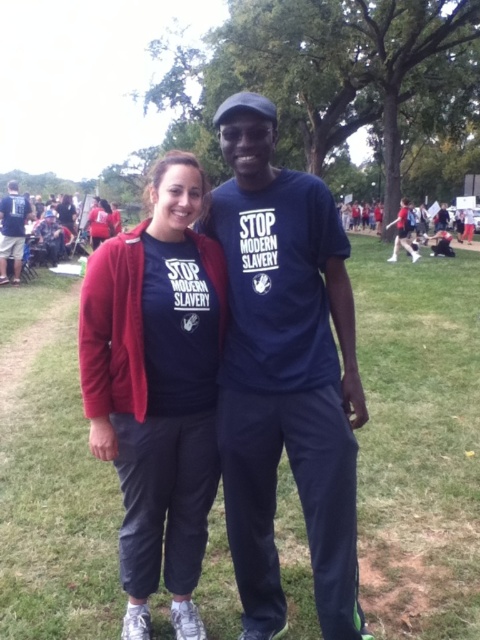
Locate an element on the screen. The width and height of the screenshot is (480, 640). navy blue t-shirt at center is located at coordinates (285, 372).

What are the coordinates of `navy blue t-shirt at center` in the screenshot? It's located at (285, 372).

Is navy blue t-shirt at center positioned in front of matte blue t-shirt at center?

Yes.

How much distance is there between navy blue t-shirt at center and matte blue t-shirt at center?

navy blue t-shirt at center and matte blue t-shirt at center are 13.10 inches apart.

Who is more forward, (254, 509) or (157, 541)?

Point (254, 509) is in front.

Locate an element on the screen. This screenshot has height=640, width=480. navy blue t-shirt at center is located at coordinates (285, 372).

The width and height of the screenshot is (480, 640). Describe the element at coordinates (156, 387) in the screenshot. I see `matte blue t-shirt at center` at that location.

Is matte blue t-shirt at center thinner than matte black t-shirt at left?

In fact, matte blue t-shirt at center might be wider than matte black t-shirt at left.

Where is `matte blue t-shirt at center`? This screenshot has width=480, height=640. matte blue t-shirt at center is located at coordinates (156, 387).